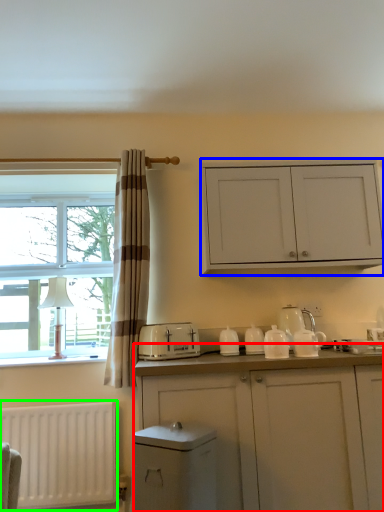
Question: Considering the real-world distances, which object is farthest from cabinetry (highlighted by a red box)? cabinetry (highlighted by a blue box) or radiator (highlighted by a green box)?

Choices:
 (A) cabinetry
 (B) radiator

Answer: (B)